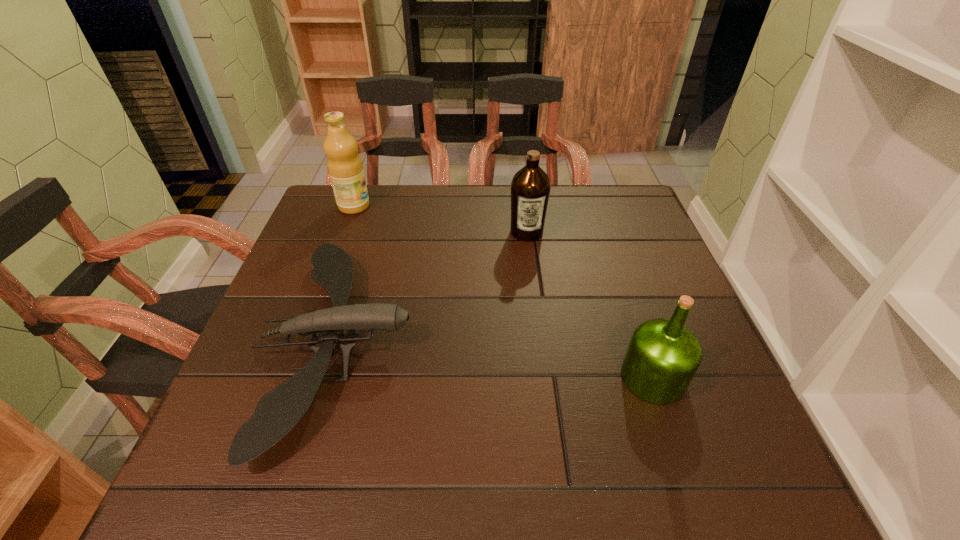
Locate an element on the screen. This screenshot has width=960, height=540. vacant space located at the head of the shortest object is located at coordinates (589, 343).

Locate an element on the screen. object at the near edge is located at coordinates (277, 412).

At what (x,y) coordinates should I click in order to perform the action: click on olive oil located at the left edge. Please return your answer as a coordinate pair (x, y). Looking at the image, I should click on (345, 168).

Find the location of a particular element. drone that is positioned at the left edge is located at coordinates click(277, 412).

Identify the location of object at the right edge. Image resolution: width=960 pixels, height=540 pixels. tap(663, 355).

Find the location of `object that is positioned at the far left corner`. object that is positioned at the far left corner is located at coordinates (345, 168).

I want to click on object present at the near left corner, so click(x=277, y=412).

You are a GUI agent. You are given a task and a screenshot of the screen. Output one action in this format:
    pyautogui.click(x=<x>, y=<y>)
    Task: Click on the vacant position at the far edge of the desktop
    The image size is (960, 540).
    Given the screenshot: What is the action you would take?
    pyautogui.click(x=397, y=205)

In the image, there is a desktop. Identify the location of vacant space at the near edge. This screenshot has width=960, height=540. (460, 458).

The image size is (960, 540). I want to click on free space at the left edge of the desktop, so click(x=317, y=246).